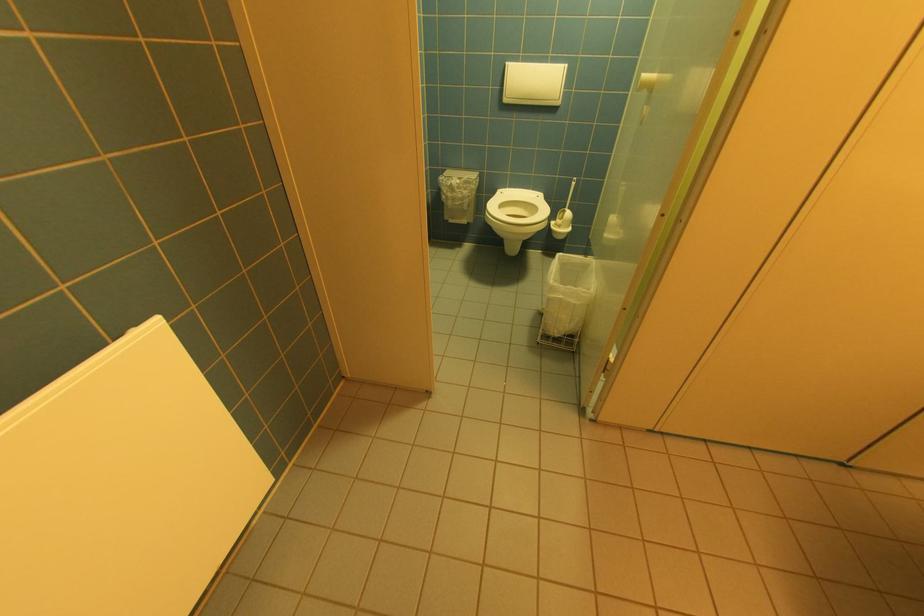
Where is `white toilet seat`? The width and height of the screenshot is (924, 616). white toilet seat is located at coordinates point(516,216).